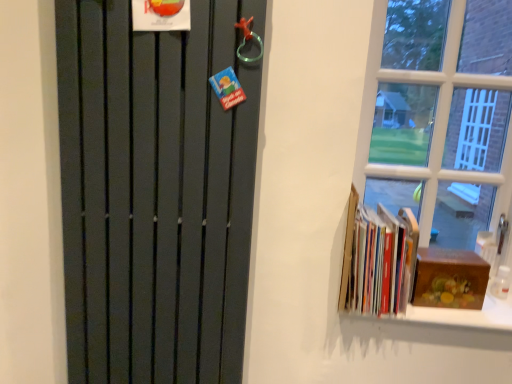
Question: Considering the relative sizes of hardcover books at right and wooden box at right in the image provided, is hardcover books at right bigger than wooden box at right?

Choices:
 (A) yes
 (B) no

Answer: (A)

Question: From a real-world perspective, is hardcover books at right positioned under wooden box at right based on gravity?

Choices:
 (A) no
 (B) yes

Answer: (A)

Question: Considering the relative sizes of hardcover books at right and wooden box at right in the image provided, is hardcover books at right smaller than wooden box at right?

Choices:
 (A) yes
 (B) no

Answer: (B)

Question: Is hardcover books at right further to the viewer compared to wooden box at right?

Choices:
 (A) no
 (B) yes

Answer: (A)

Question: Is hardcover books at right positioned with its back to wooden box at right?

Choices:
 (A) no
 (B) yes

Answer: (A)

Question: From a real-world perspective, is hardcover books at right positioned over wooden box at right based on gravity?

Choices:
 (A) yes
 (B) no

Answer: (A)

Question: Is matte black radiator at left far away from wooden box at right?

Choices:
 (A) yes
 (B) no

Answer: (B)

Question: Is wooden box at right surrounded by matte black radiator at left?

Choices:
 (A) no
 (B) yes

Answer: (A)

Question: From the image's perspective, is matte black radiator at left below wooden box at right?

Choices:
 (A) no
 (B) yes

Answer: (A)

Question: Is matte black radiator at left aimed at wooden box at right?

Choices:
 (A) yes
 (B) no

Answer: (B)

Question: Is matte black radiator at left wider than wooden box at right?

Choices:
 (A) yes
 (B) no

Answer: (B)

Question: Considering the relative sizes of matte black radiator at left and wooden box at right in the image provided, is matte black radiator at left shorter than wooden box at right?

Choices:
 (A) yes
 (B) no

Answer: (B)

Question: Considering the relative positions of hardcover books at right and matte black radiator at left in the image provided, is hardcover books at right behind matte black radiator at left?

Choices:
 (A) yes
 (B) no

Answer: (A)